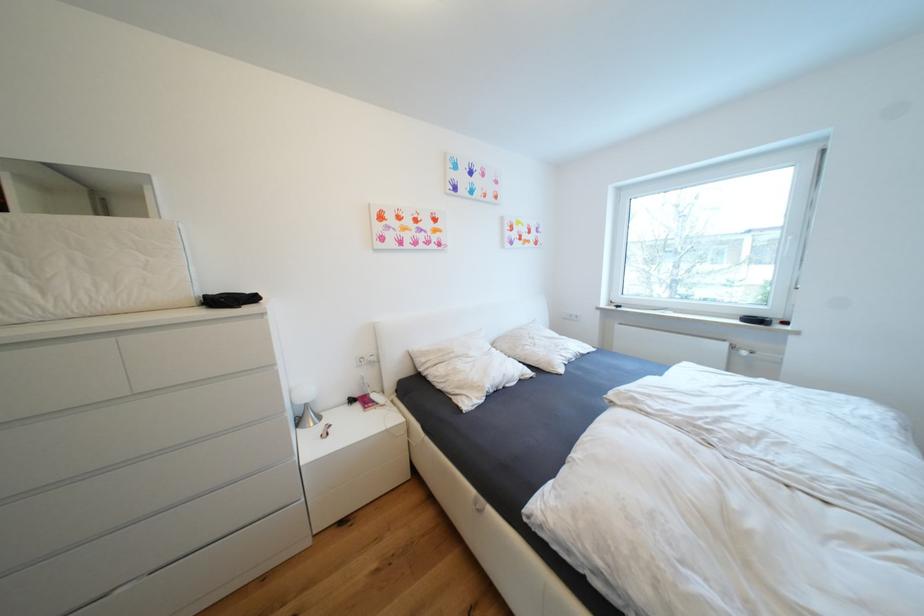
Which object does [305,403] point to?

It refers to a white table lamp.